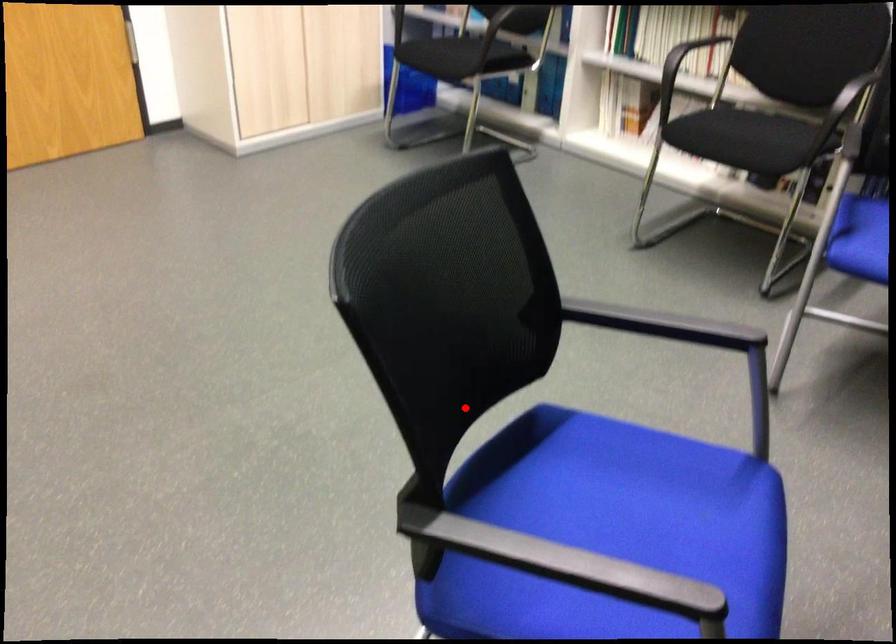
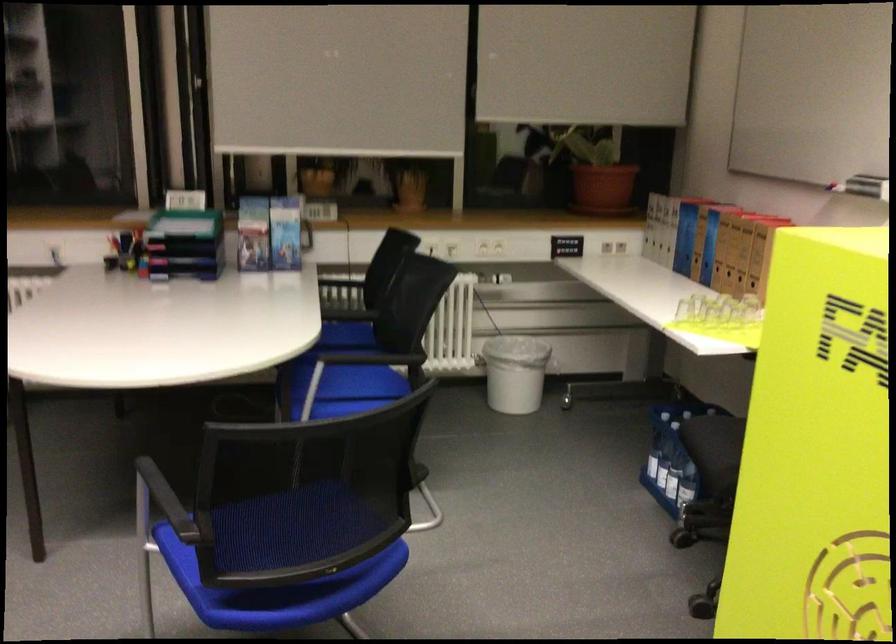
Question: I am providing you with two images of the same scene from different viewpoints. Image1 has a red point marked. In image2, the corresponding 3D location appears at what relative position? Reply with the corresponding letter.

Choices:
 (A) Closer
 (B) Farther

Answer: (B)